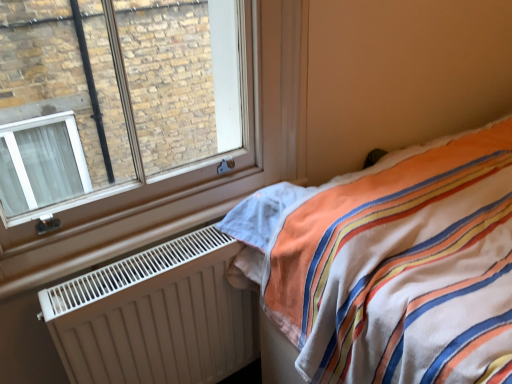
Question: Which is correct: clear glass window at upper left is inside white matte radiator at lower left, or outside of it?

Choices:
 (A) outside
 (B) inside

Answer: (A)

Question: From their relative heights in the image, would you say clear glass window at upper left is taller or shorter than white matte radiator at lower left?

Choices:
 (A) short
 (B) tall

Answer: (B)

Question: Which object is positioned farthest from the clear glass window at upper left?

Choices:
 (A) white matte radiator at lower left
 (B) striped cotton bed at right

Answer: (B)

Question: Which object is positioned farthest from the clear glass window at upper left?

Choices:
 (A) striped cotton bed at right
 (B) white matte radiator at lower left

Answer: (A)